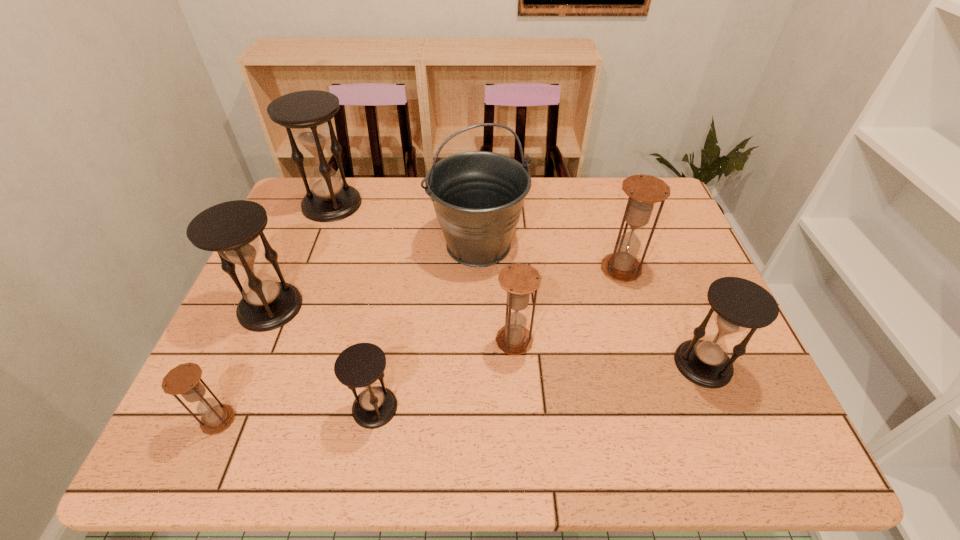
The image size is (960, 540). I want to click on object that stands as the fourth closest to the farthest black hourglass, so click(358, 366).

Identify the location of hourglass that is the sixth closest to the farthest black hourglass. (738, 304).

Find the location of a particular element. hourglass object that ranks as the seventh closest to the bucket is located at coordinates (184, 379).

Identify the location of black hourglass that stands as the fourth closest to the smallest brown hourglass. This screenshot has width=960, height=540. (738, 304).

Identify which black hourglass is the second closest to the farthest brown hourglass. Please provide its 2D coordinates. Your answer should be formatted as a tuple, i.e. [(x, y)], where the tuple contains the x and y coordinates of a point satisfying the conditions above.

[(358, 366)]

Find the location of a particular element. The width and height of the screenshot is (960, 540). brown hourglass that stands as the closest to the third nearest black hourglass is located at coordinates (184, 379).

At what (x,y) coordinates should I click in order to perform the action: click on brown hourglass that stands as the closest to the second nearest brown hourglass. Please return your answer as a coordinate pair (x, y). Image resolution: width=960 pixels, height=540 pixels. Looking at the image, I should click on (644, 191).

Locate an element on the screen. free space that satisfies the following two spatial constraints: 1. on the front side of the second hourglass from right to left; 2. on the left side of the farthest black hourglass is located at coordinates tap(307, 269).